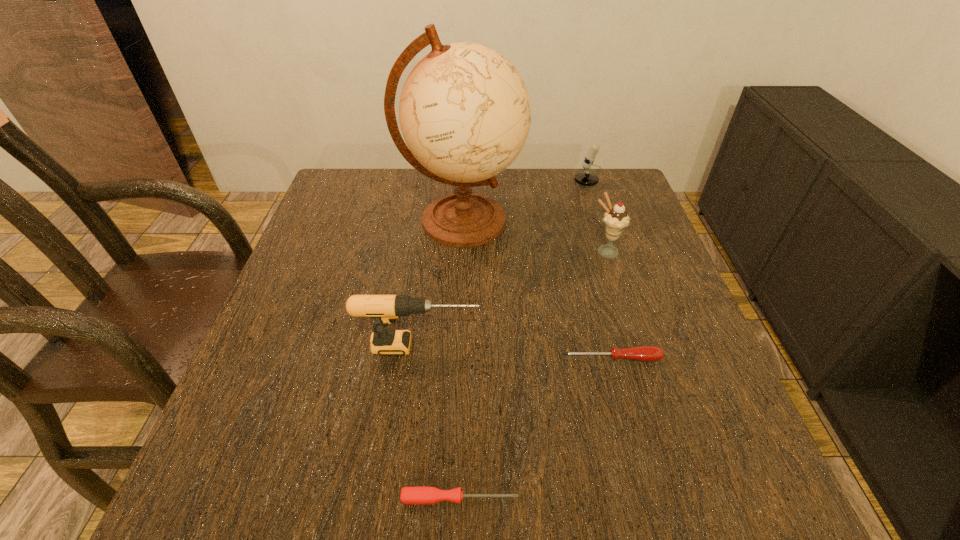
Identify the location of globe. (465, 113).

Where is `icecream`? Image resolution: width=960 pixels, height=540 pixels. icecream is located at coordinates click(x=616, y=219).

Image resolution: width=960 pixels, height=540 pixels. I want to click on drill, so click(384, 309).

Find the location of a particular element. This screenshot has height=540, width=960. microphone is located at coordinates [x=586, y=178].

You are a GUI agent. You are given a task and a screenshot of the screen. Output one action in this format:
    pyautogui.click(x=<x>, y=<y>)
    Task: Click on the taller screwdriver
    
    Given the screenshot: What is the action you would take?
    pyautogui.click(x=641, y=353)

Locate an element on the screen. The width and height of the screenshot is (960, 540). the farther screwdriver is located at coordinates (641, 353).

I want to click on the nearest object, so click(x=415, y=495).

Where is `the shorter screwdriver`? This screenshot has height=540, width=960. the shorter screwdriver is located at coordinates (415, 495).

Identify the location of free point located on the surface of the globe. This screenshot has height=540, width=960. (580, 221).

Where is `free point located on the front of the icecream`? This screenshot has height=540, width=960. free point located on the front of the icecream is located at coordinates point(627,319).